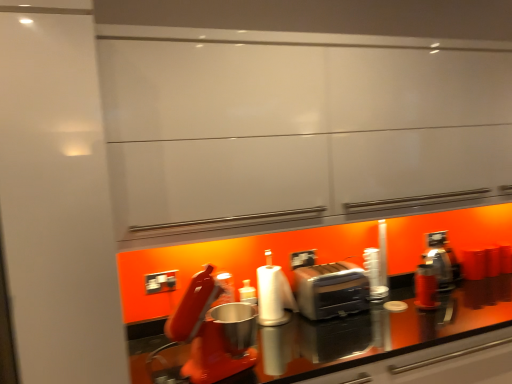
Question: Is satin silver toaster at center in front of or behind white matte paper towel at center in the image?

Choices:
 (A) behind
 (B) front

Answer: (A)

Question: Visually, is satin silver toaster at center positioned to the left or to the right of white matte paper towel at center?

Choices:
 (A) right
 (B) left

Answer: (A)

Question: Is satin silver toaster at center wider or thinner than white matte paper towel at center?

Choices:
 (A) wide
 (B) thin

Answer: (A)

Question: Does point (262, 296) appear closer or farther from the camera than point (309, 309)?

Choices:
 (A) closer
 (B) farther

Answer: (A)

Question: Is white matte paper towel at center taller or shorter than satin silver toaster at center?

Choices:
 (A) short
 (B) tall

Answer: (B)

Question: From the image's perspective, relative to satin silver toaster at center, is white matte paper towel at center above or below?

Choices:
 (A) above
 (B) below

Answer: (A)

Question: From a real-world perspective, is white matte paper towel at center physically located above or below satin silver toaster at center?

Choices:
 (A) below
 (B) above

Answer: (B)